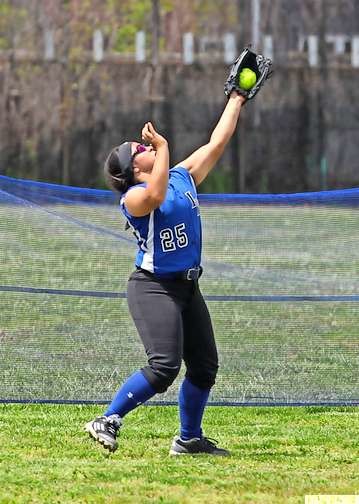
At what (x,y) coordinates should I click in order to perform the action: click on sock. Please return your answer as a coordinate pair (x, y). The height and width of the screenshot is (504, 359). Looking at the image, I should click on pos(129,396), pos(196,413).